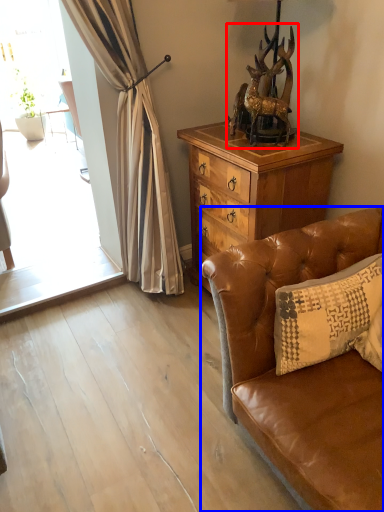
Question: Among these objects, which one is farthest to the camera, animal (highlighted by a red box) or studio couch (highlighted by a blue box)?

Choices:
 (A) animal
 (B) studio couch

Answer: (A)